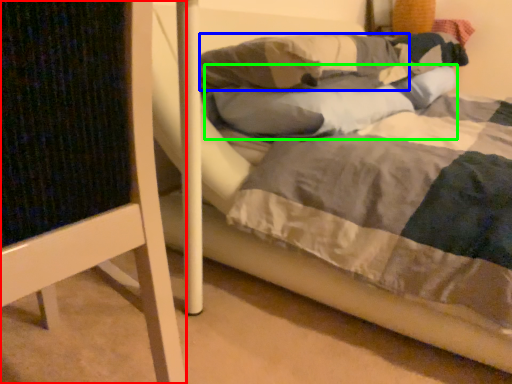
Question: Which is farther away from furniture (highlighted by a red box)? pillow (highlighted by a blue box) or pillow (highlighted by a green box)?

Choices:
 (A) pillow
 (B) pillow

Answer: (A)